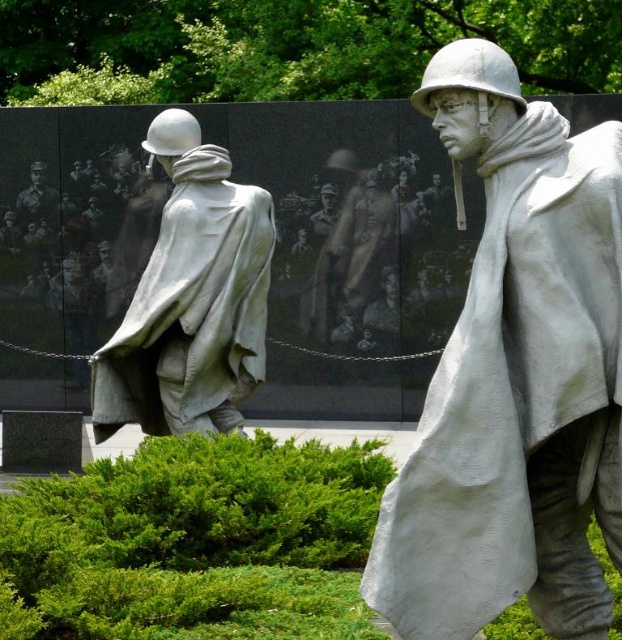
Does matte silver statue at left lie in front of matte black uniform at center?

Yes, matte silver statue at left is closer to the viewer.

Is matte silver statue at left thinner than matte black uniform at center?

In fact, matte silver statue at left might be wider than matte black uniform at center.

Between point (137, 416) and point (49, 220), which one is positioned in front?

Point (137, 416) is more forward.

What are the coordinates of `matte silver statue at left` in the screenshot? It's located at (190, 298).

Can you confirm if white matte helmet at center is taller than matte black uniform at center?

Indeed, white matte helmet at center has a greater height compared to matte black uniform at center.

Is point (389, 545) positioned after point (37, 216)?

No, it is not.

The width and height of the screenshot is (622, 640). What are the coordinates of `white matte helmet at center` in the screenshot? It's located at [x=514, y=378].

Is white matte helmet at center to the right of matte silver statue at left from the viewer's perspective?

Correct, you'll find white matte helmet at center to the right of matte silver statue at left.

Between point (503, 172) and point (183, 189), which one is positioned behind?

The point (183, 189) is more distant.

This screenshot has height=640, width=622. Find the location of `white matte helmet at center`. white matte helmet at center is located at coordinates (514, 378).